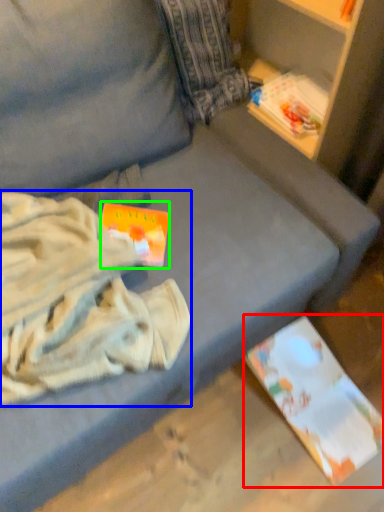
Question: Based on their relative distances, which object is farther from paperback book (highlighted by a red box)? Choose from clothing (highlighted by a blue box) and paperback book (highlighted by a green box).

Choices:
 (A) clothing
 (B) paperback book

Answer: (B)